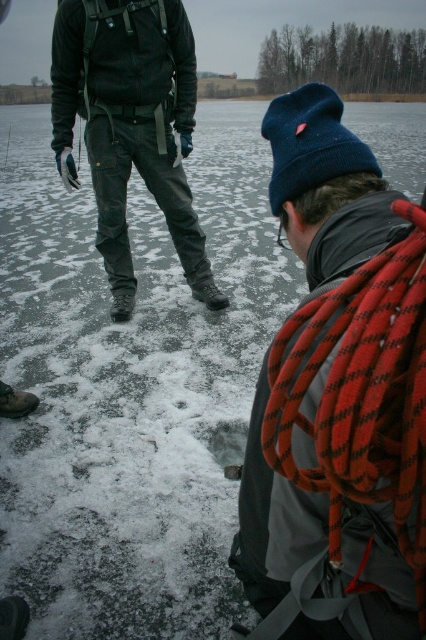
Who is higher up, red rope at center or dark green pants at center?

dark green pants at center is above.

Is point (411, 369) positioned before point (115, 64)?

Yes, it is.

At what (x,y) coordinates should I click in order to perform the action: click on red rope at center. Please return your answer as a coordinate pair (x, y). This screenshot has height=640, width=426. Looking at the image, I should click on (339, 397).